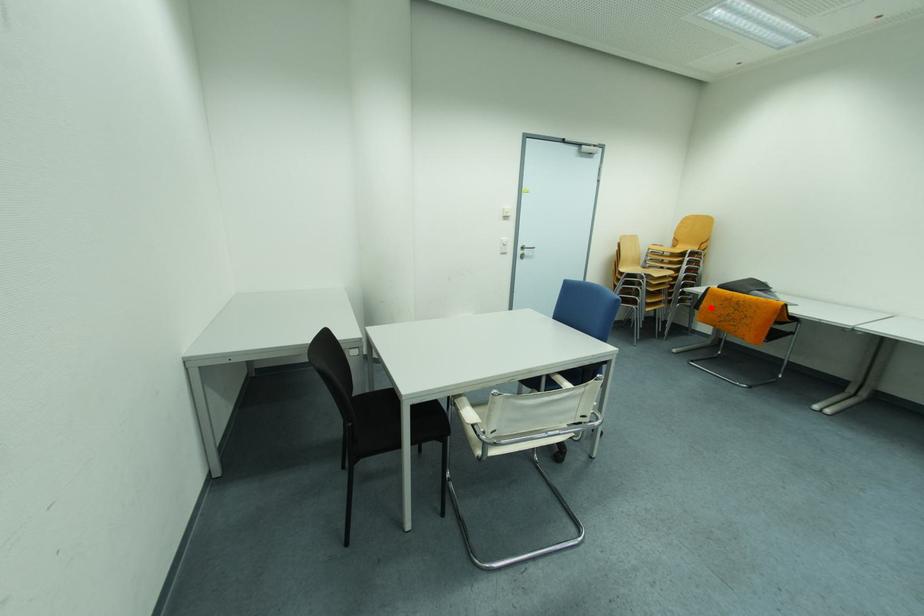
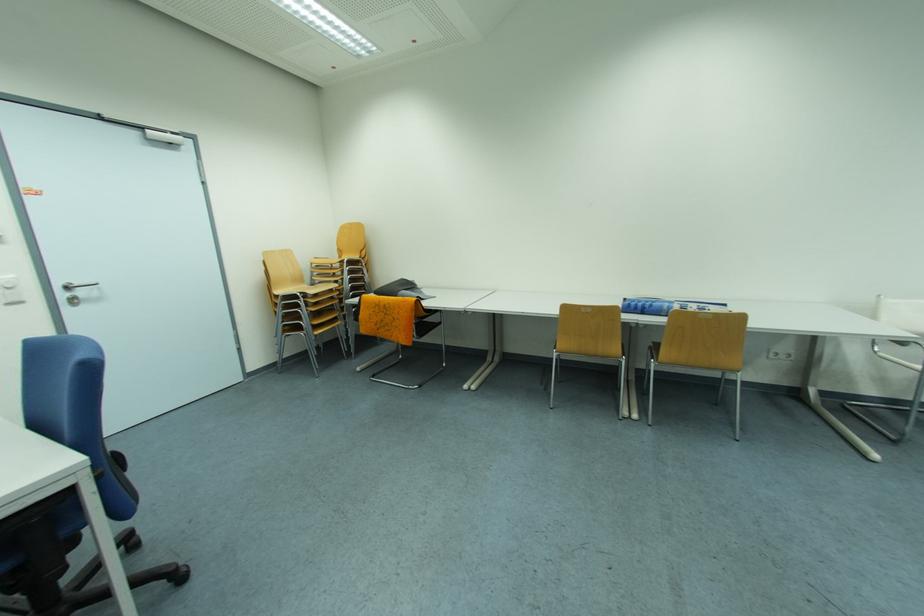
Locate, in the second image, the point that corresponds to the highlighted location in the first image.

(369, 318)